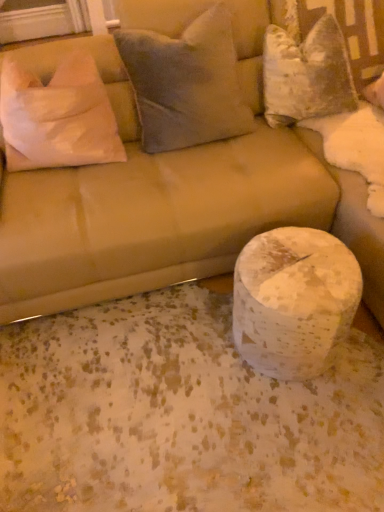
Question: Is white speckled marble at lower right smaller than suede beige couch at center?

Choices:
 (A) no
 (B) yes

Answer: (B)

Question: Is white speckled marble at lower right positioned beyond the bounds of suede beige couch at center?

Choices:
 (A) no
 (B) yes

Answer: (B)

Question: Does white speckled marble at lower right appear on the right side of suede beige couch at center?

Choices:
 (A) no
 (B) yes

Answer: (B)

Question: From the image's perspective, is white speckled marble at lower right on top of suede beige couch at center?

Choices:
 (A) no
 (B) yes

Answer: (A)

Question: Is white speckled marble at lower right not near suede beige couch at center?

Choices:
 (A) no
 (B) yes

Answer: (A)

Question: Based on their sizes in the image, would you say white fabric pillow at left, marked as the third pillow in a right-to-left arrangement, is bigger or smaller than velvet white pillow at upper right, positioned as the first pillow in right-to-left order?

Choices:
 (A) big
 (B) small

Answer: (B)

Question: Considering the relative positions of white fabric pillow at left, which ranks as the first pillow in left-to-right order, and velvet white pillow at upper right, positioned as the first pillow in right-to-left order, in the image provided, is white fabric pillow at left, which ranks as the first pillow in left-to-right order, to the left or to the right of velvet white pillow at upper right, positioned as the first pillow in right-to-left order,?

Choices:
 (A) left
 (B) right

Answer: (A)

Question: Considering their positions, is white fabric pillow at left, which ranks as the first pillow in left-to-right order, located in front of or behind velvet white pillow at upper right, the third pillow when ordered from left to right?

Choices:
 (A) front
 (B) behind

Answer: (A)

Question: From a real-world perspective, is white fabric pillow at left, which ranks as the first pillow in left-to-right order, positioned above or below velvet white pillow at upper right, the third pillow when ordered from left to right?

Choices:
 (A) above
 (B) below

Answer: (A)

Question: Is velvety gray pillow at upper center, which is the 2th pillow from right to left, bigger or smaller than white speckled marble at lower right?

Choices:
 (A) big
 (B) small

Answer: (A)

Question: Considering the relative positions of velvety gray pillow at upper center, which is the 2th pillow from right to left, and white speckled marble at lower right in the image provided, is velvety gray pillow at upper center, which is the 2th pillow from right to left, to the left or to the right of white speckled marble at lower right?

Choices:
 (A) right
 (B) left

Answer: (B)

Question: Considering the positions of point (165, 35) and point (324, 310), is point (165, 35) closer or farther from the camera than point (324, 310)?

Choices:
 (A) farther
 (B) closer

Answer: (A)

Question: Choose the correct answer: Is velvety gray pillow at upper center, which is the 2th pillow from right to left, inside white speckled marble at lower right or outside it?

Choices:
 (A) outside
 (B) inside

Answer: (A)

Question: Is suede beige couch at center wider or thinner than white fabric pillow at left, which ranks as the first pillow in left-to-right order?

Choices:
 (A) wide
 (B) thin

Answer: (A)

Question: Is suede beige couch at center inside the boundaries of white fabric pillow at left, which ranks as the first pillow in left-to-right order, or outside?

Choices:
 (A) inside
 (B) outside

Answer: (B)